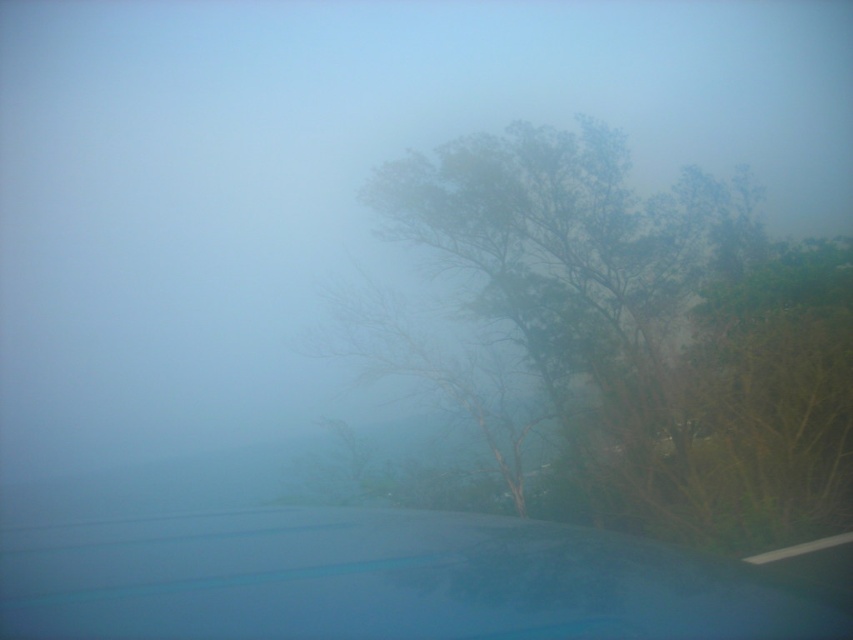
You are sitting in the driver seat of the car and looking out through the windshield. There are two points marked on the hood of the car, one at coordinate point (717, 266) and another at point (236, 525). Which point is closer to you?

Point (236, 525) is closer to you because it is nearer to the camera compared to point (717, 266), which is further away.